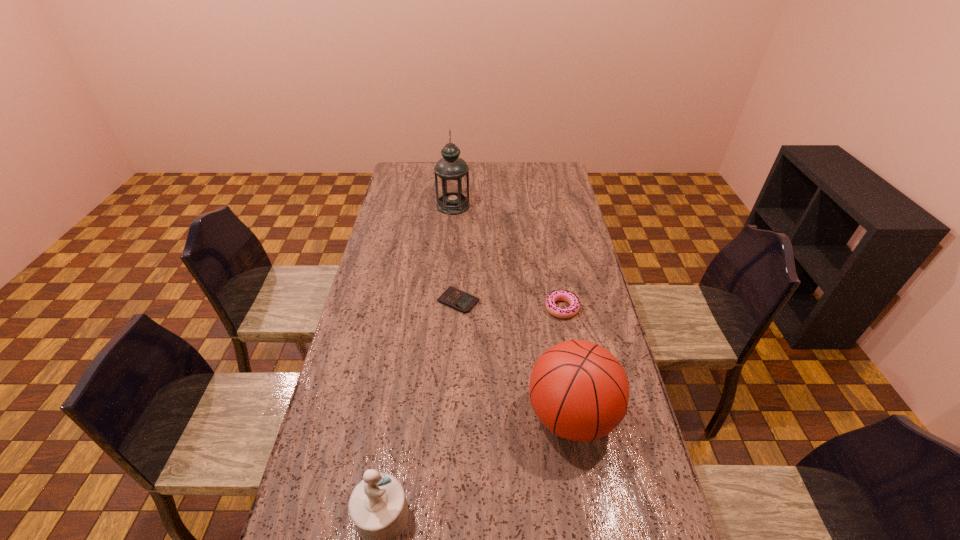
You are a GUI agent. You are given a task and a screenshot of the screen. Output one action in this format:
    pyautogui.click(x=<x>, y=<y>)
    Task: Click on the unoccupied area between the calculator and the doughnut
    
    Given the screenshot: What is the action you would take?
    pyautogui.click(x=510, y=305)

Find the location of a particular element. This screenshot has height=540, width=960. vacant area that lies between the basketball and the calculator is located at coordinates (515, 359).

The height and width of the screenshot is (540, 960). Identify the location of vacant point located between the second shortest object and the oil lamp. (508, 257).

Point out which object is positioned as the third nearest to the fourth shortest object. Please provide its 2D coordinates. Your answer should be formatted as a tuple, i.e. [(x, y)], where the tuple contains the x and y coordinates of a point satisfying the conditions above.

[(377, 506)]

This screenshot has height=540, width=960. What are the coordinates of `object that stands as the closest to the second tallest object` in the screenshot? It's located at (559, 295).

Where is `vacant space that satisfies the following two spatial constraints: 1. on the front side of the doughnut; 2. on the right side of the calculator`? vacant space that satisfies the following two spatial constraints: 1. on the front side of the doughnut; 2. on the right side of the calculator is located at coordinates (458, 308).